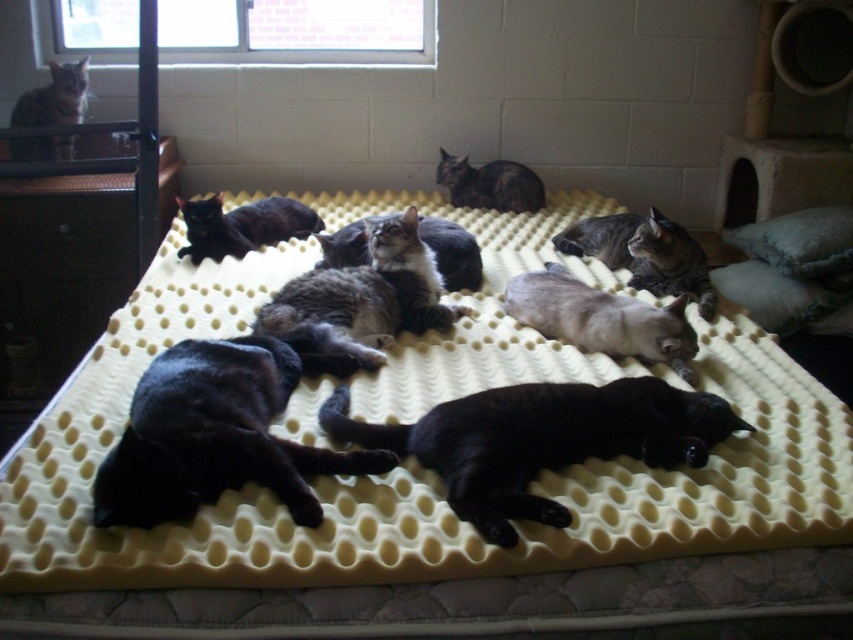
Question: Does white fur at center appear under gray fabric pillow at upper right?

Choices:
 (A) no
 (B) yes

Answer: (B)

Question: Which point is farther to the camera?

Choices:
 (A) (714, 397)
 (B) (209, 221)

Answer: (B)

Question: Is soft gray pillow at right bigger than gray-furred cat at center?

Choices:
 (A) no
 (B) yes

Answer: (B)

Question: Is gray tabby cat at upper left to the right of black fur cat at center from the viewer's perspective?

Choices:
 (A) no
 (B) yes

Answer: (A)

Question: Which is farther from the tabby fur cat at center?

Choices:
 (A) black fur cat at center
 (B) black fur cat at upper left
 (C) gray tabby cat at upper left
 (D) yellow foam mattress at center

Answer: (C)

Question: Which point appears farthest from the camera in this image?

Choices:
 (A) (62, 124)
 (B) (503, 211)

Answer: (B)